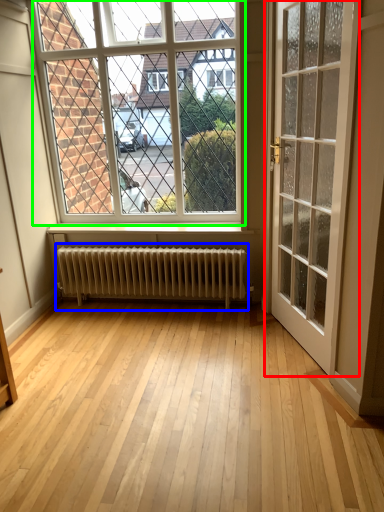
Question: Estimate the real-world distances between objects in this image. Which object is farther from door (highlighted by a red box), radiator (highlighted by a blue box) or window (highlighted by a green box)?

Choices:
 (A) radiator
 (B) window

Answer: (B)